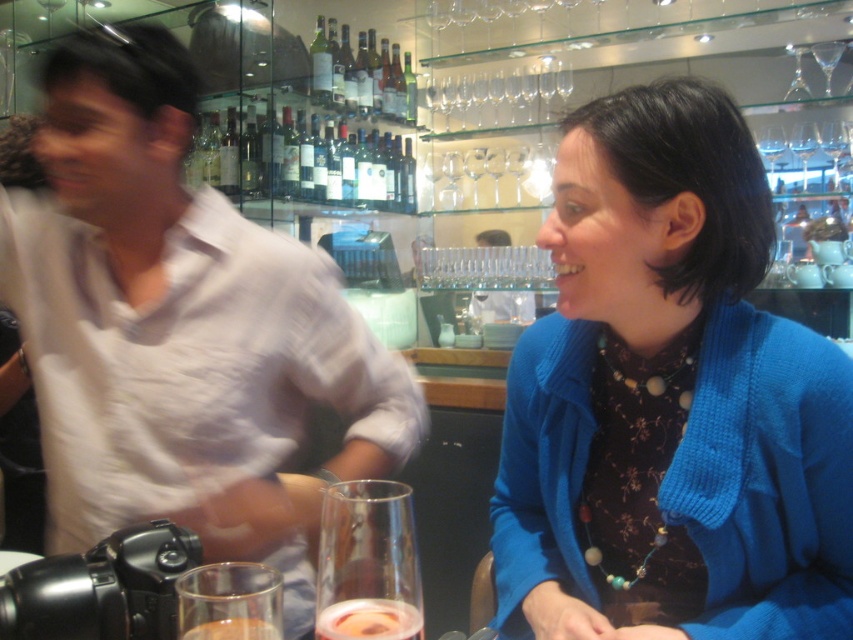
Question: Estimate the real-world distances between objects in this image. Which object is closer to the translucent glass wine at center?

Choices:
 (A) white cotton shirt at left
 (B) clear glass at lower left
 (C) blue knitted cardigan at upper right

Answer: (B)

Question: Where is blue knitted cardigan at upper right located in relation to clear glass at lower left in the image?

Choices:
 (A) above
 (B) below

Answer: (A)

Question: Does translucent glass wine bottle at center have a lesser width compared to translucent glass wine at center?

Choices:
 (A) no
 (B) yes

Answer: (A)

Question: Is green glass bottle at upper center smaller than translucent glass wine at center?

Choices:
 (A) yes
 (B) no

Answer: (B)

Question: Among these objects, which one is farthest from the camera?

Choices:
 (A) blue knitted cardigan at upper right
 (B) translucent glass wine bottle at center
 (C) white cotton shirt at left

Answer: (B)

Question: Which point is farther to the camera?

Choices:
 (A) (321, 524)
 (B) (318, 61)
 (C) (357, 611)

Answer: (B)